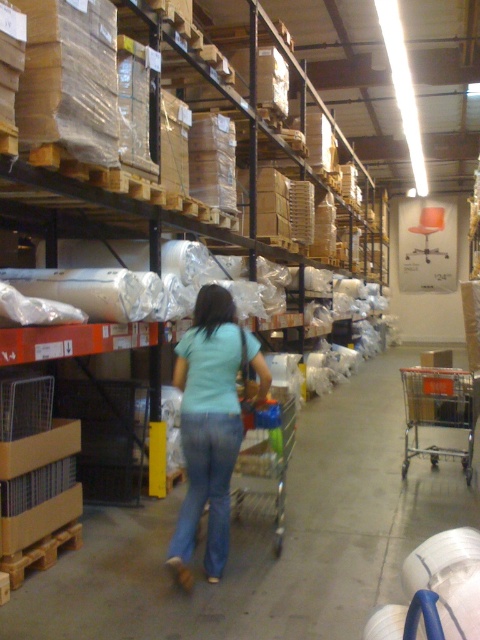
Is blue denim jeans at center closer to the viewer compared to metallic silver trolley at center-right?

Yes, blue denim jeans at center is in front of metallic silver trolley at center-right.

Who is taller, blue denim jeans at center or metallic silver trolley at center-right?

With more height is metallic silver trolley at center-right.

Identify the location of blue denim jeans at center. (205, 490).

Locate an element on the screen. The height and width of the screenshot is (640, 480). blue denim jeans at center is located at coordinates 205,490.

Which of these two, blue denim jeans at center or metallic silver trolley at center, stands shorter?

metallic silver trolley at center

Can you confirm if blue denim jeans at center is wider than metallic silver trolley at center?

No.

Find the location of a particular element. This screenshot has height=640, width=480. blue denim jeans at center is located at coordinates (205, 490).

I want to click on blue denim jeans at center, so click(x=205, y=490).

Who is more forward, (x=214, y=332) or (x=287, y=428)?

Positioned in front is point (x=214, y=332).

Looking at this image, which is more to the left, light blue denim jeans at center or metallic silver trolley at center?

light blue denim jeans at center is more to the left.

Between point (201, 378) and point (253, 416), which one is positioned behind?

The point (253, 416) is more distant.

This screenshot has width=480, height=640. I want to click on light blue denim jeans at center, so click(x=211, y=424).